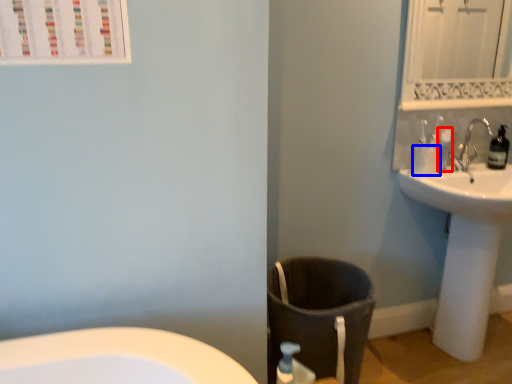
Question: Which object is closer to the camera taking this photo, toiletry (highlighted by a red box) or toilet paper (highlighted by a blue box)?

Choices:
 (A) toiletry
 (B) toilet paper

Answer: (B)